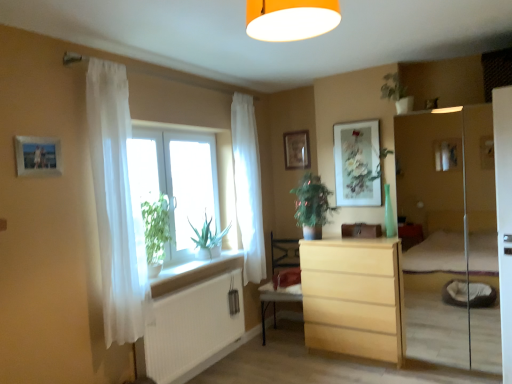
Question: From a real-world perspective, relative to white sheer curtain at window, positioned as the first curtain in right-to-left order, is matte floral artwork at upper center, which is counted as the 2th picture frame, starting from the back, vertically above or below?

Choices:
 (A) below
 (B) above

Answer: (B)

Question: In terms of width, does matte floral artwork at upper center, the 3th picture frame when ordered from left to right, look wider or thinner when compared to white sheer curtain at window, acting as the 2th curtain starting from the front?

Choices:
 (A) thin
 (B) wide

Answer: (A)

Question: Which of these objects is positioned farthest from the light wood chest of drawers at center?

Choices:
 (A) green leafy plant at center
 (B) green matte plant at upper center
 (C) white sheer curtain at window, which is the second curtain in left-to-right order
 (D) matte wooden picture frame at upper center, acting as the third picture frame starting from the front
 (E) wooden armchair at center

Answer: (B)

Question: Which of these objects is positioned farthest from the green matte plant at upper center?

Choices:
 (A) green leafy plant at center
 (B) white sheer curtain at left, which appears as the 1th curtain when viewed from the left
 (C) transparent glass window at center
 (D) matte floral artwork at upper center, which is counted as the first picture frame, starting from the right
 (E) light wood chest of drawers at center

Answer: (B)